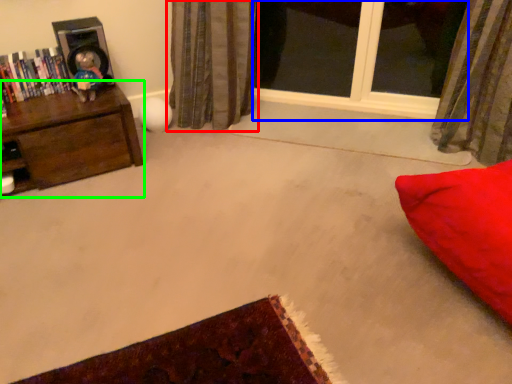
Question: Which is farther away from curtain (highlighted by a red box)? window (highlighted by a blue box) or furniture (highlighted by a green box)?

Choices:
 (A) window
 (B) furniture

Answer: (B)